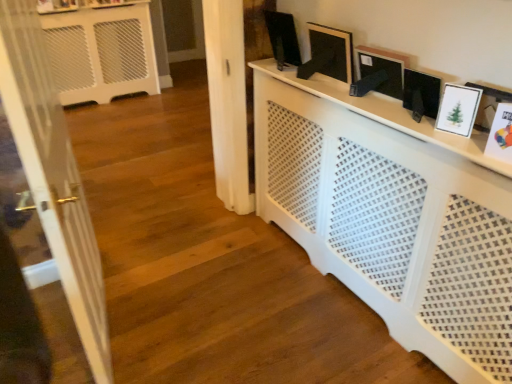
Where is `vacant region to the left of white glossy picture frame at upper right, which is counted as the second picture frame, starting from the right`? vacant region to the left of white glossy picture frame at upper right, which is counted as the second picture frame, starting from the right is located at coordinates (416, 124).